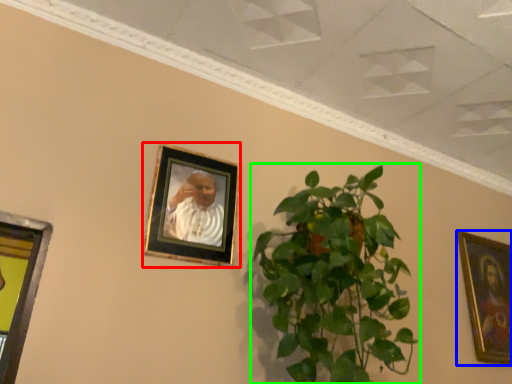
Question: Based on their relative distances, which object is nearer to picture frame (highlighted by a red box)? Choose from picture frame (highlighted by a blue box) and houseplant (highlighted by a green box).

Choices:
 (A) picture frame
 (B) houseplant

Answer: (B)